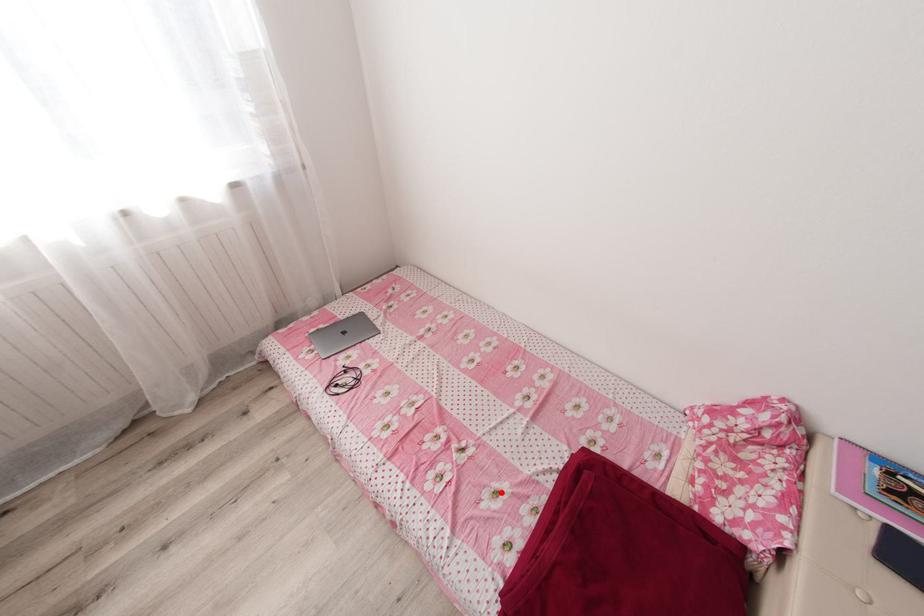
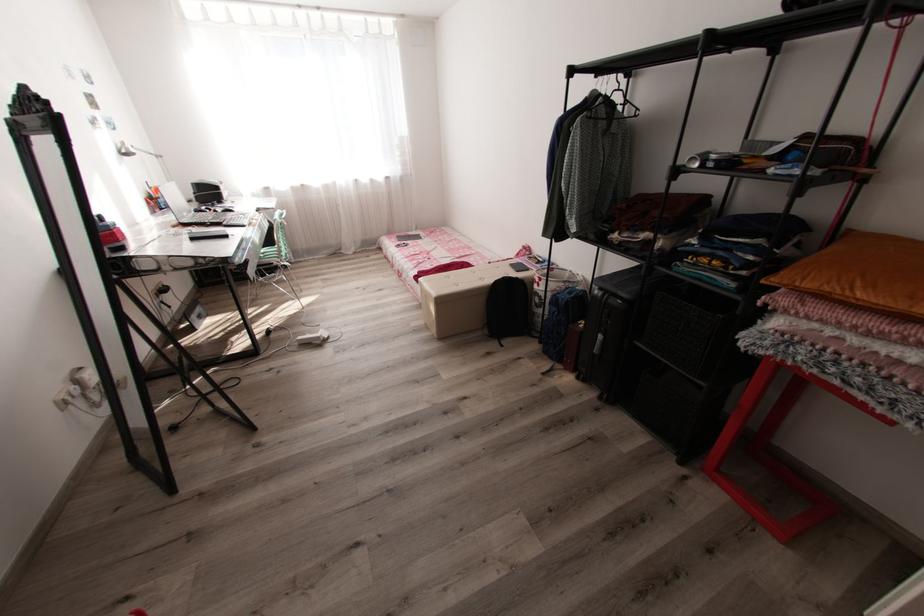
Question: I am providing you with two images of the same scene from different viewpoints. Given a red point in image1, look at the same physical point in image2. Is it:

Choices:
 (A) Closer to the viewpoint
 (B) Farther from the viewpoint

Answer: (B)